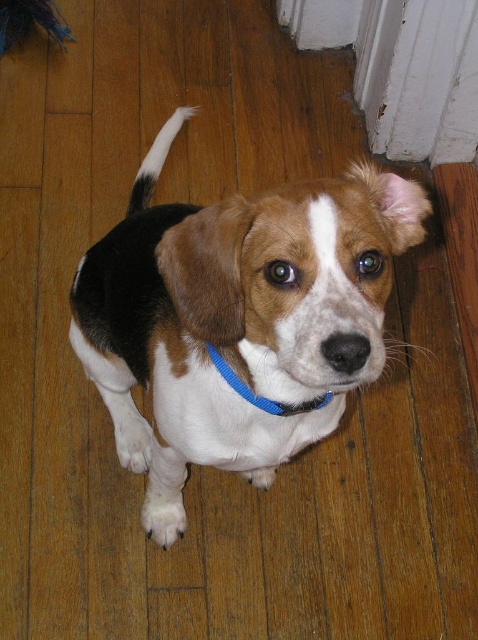
From the picture: You are a dog trainer assessing the space between the white fur tail at upper center and the blue fabric neckband at center on a dog. Can the dog comfortably move its tail without touching the neckband if the minimum required space is 90 centimeters?

The distance between the white fur tail at upper center and the blue fabric neckband at center is 89.29 centimeters, which is slightly less than the required 90 centimeters. Therefore, the dog may not have enough space to move its tail comfortably without touching the neckband.

The beagle dog in the scene has two notable features. One is its white fur tail at upper center and the other is its blue fabric neckband at center. From the perspective of someone looking at the dog head on, which of these features is positioned higher on the dog?

The white fur tail at upper center is located above the blue fabric neckband at center, so the white fur tail at upper center is positioned higher on the dog.